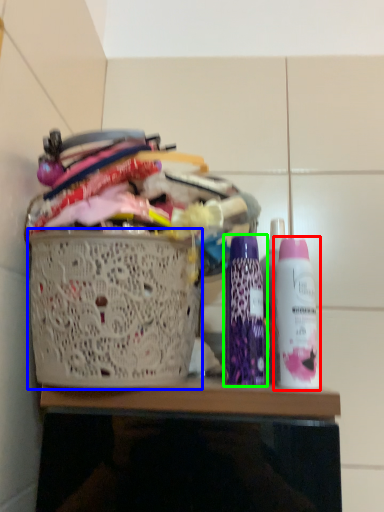
Question: Based on their relative distances, which object is farther from bottle (highlighted by a red box)? Choose from basket (highlighted by a blue box) and bottle (highlighted by a green box).

Choices:
 (A) basket
 (B) bottle

Answer: (A)